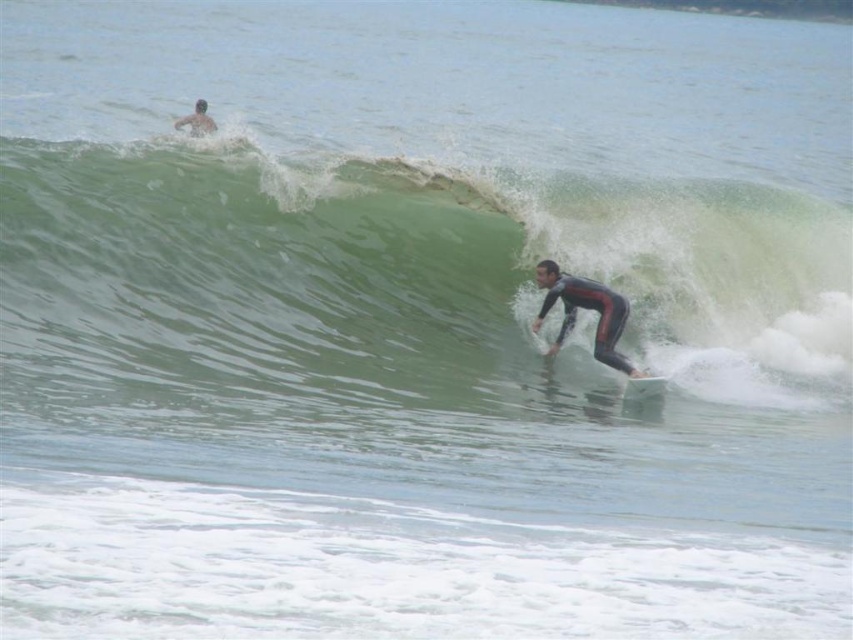
You are a photographer trying to capture the surfer action. You need to know which object is wider between the skinny man at upper left and the white foam surfboard at center. Which one is wider?

The skinny man at upper left is wider than the white foam surfboard at center according to the description.

You are a lifeguard observing the ocean scene. There is a point marked at coordinates [584,308]. What object is located at that point?

The point at coordinates [584,308] marks the location of the black matte wetsuit at center.

You are a photographer trying to capture the surfer in the image. Since you want to focus on the surfer, which object should you zoom in on more, the black matte wetsuit at center or the white foam surfboard at center?

The black matte wetsuit at center is larger in size than the white foam surfboard at center, so you should zoom in on the black matte wetsuit at center to focus on the surfer.